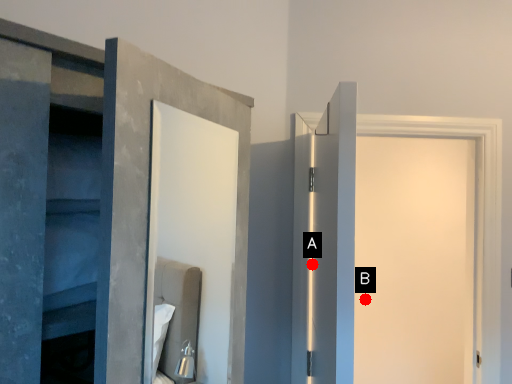
Question: Two points are circled on the image, labeled by A and B beside each circle. Which point is farther from the camera taking this photo?

Choices:
 (A) A is further
 (B) B is further

Answer: (B)